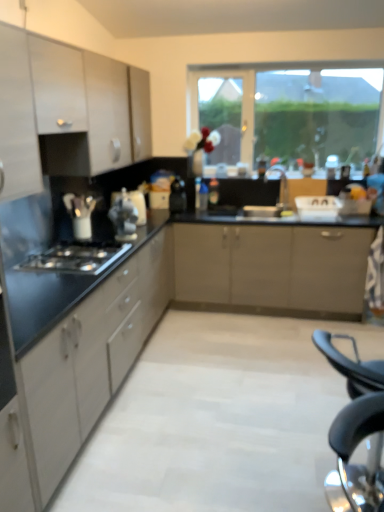
Find the location of a particular element. free space to the left of matte silver faucet at center is located at coordinates (252, 212).